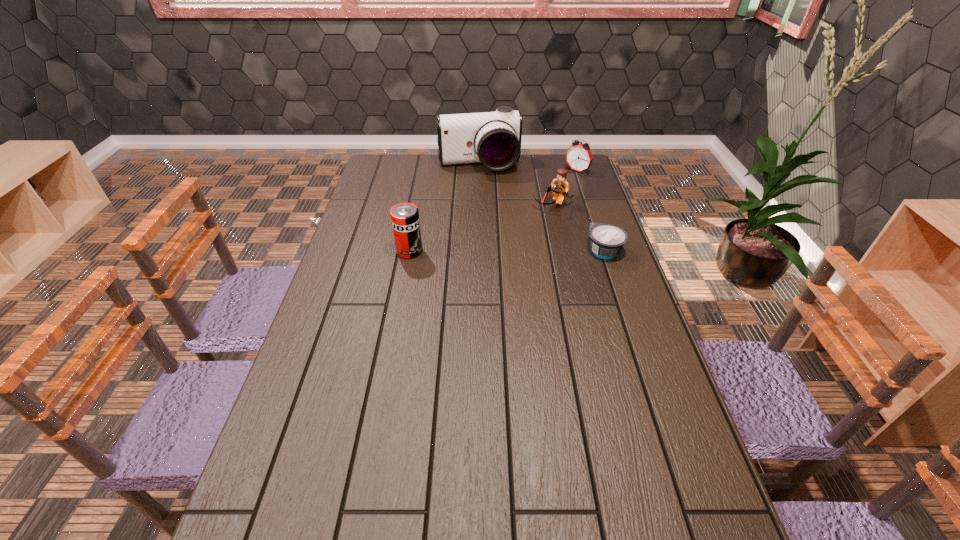
Where is `vacant space located 0.330m holding a crossbow in the hands of the third farthest object`? The width and height of the screenshot is (960, 540). vacant space located 0.330m holding a crossbow in the hands of the third farthest object is located at coordinates (506, 264).

You are a GUI agent. You are given a task and a screenshot of the screen. Output one action in this format:
    pyautogui.click(x=<x>, y=<y>)
    Task: Click on the free region located holding a crossbow in the hands of the third farthest object
    The image size is (960, 540).
    Given the screenshot: What is the action you would take?
    pyautogui.click(x=536, y=224)

In order to click on vacant space positioned on the clock face of the alarm clock in this screenshot , I will do `click(562, 182)`.

Where is `vacant area located 0.080m on the clock face of the alarm clock`? vacant area located 0.080m on the clock face of the alarm clock is located at coordinates [x=561, y=183].

Find the location of a particular element. The width and height of the screenshot is (960, 540). vacant position located 0.110m on the clock face of the alarm clock is located at coordinates (557, 186).

You are a GUI agent. You are given a task and a screenshot of the screen. Output one action in this format:
    pyautogui.click(x=<x>, y=<y>)
    Task: Click on the free point located on the surface of the tallest object
    
    Given the screenshot: What is the action you would take?
    tap(498, 217)

What are the coordinates of `vacant space located on the surface of the tallest object` in the screenshot? It's located at (491, 194).

Locate an element on the screen. This screenshot has width=960, height=540. vacant region located 0.370m on the surface of the tallest object is located at coordinates (502, 230).

Where is `alarm clock present at the far edge`? alarm clock present at the far edge is located at coordinates point(578,157).

Locate an element on the screen. camcorder that is at the far edge is located at coordinates (492, 138).